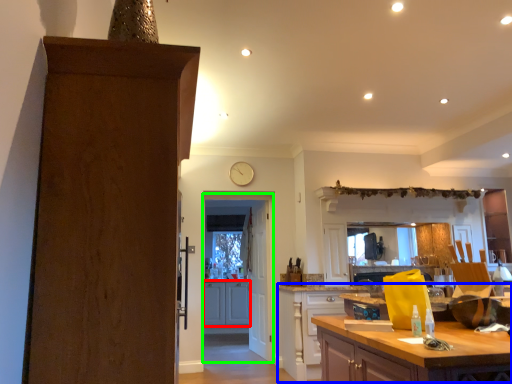
Question: Which object is the farthest from cabinetry (highlighted by a red box)? Choose among these: cabinetry (highlighted by a blue box) or door (highlighted by a green box).

Choices:
 (A) cabinetry
 (B) door

Answer: (A)